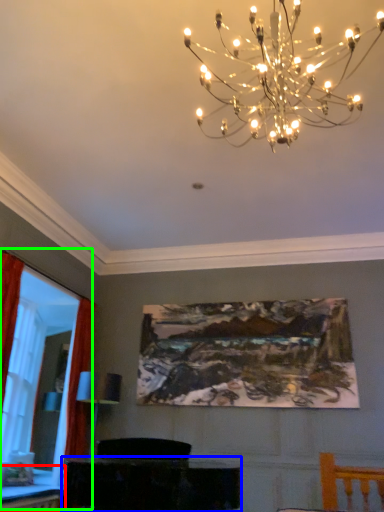
Question: Based on their relative distances, which object is nearer to table (highlighted by a red box)? Choose from furniture (highlighted by a blue box) and bay window (highlighted by a green box).

Choices:
 (A) furniture
 (B) bay window

Answer: (B)